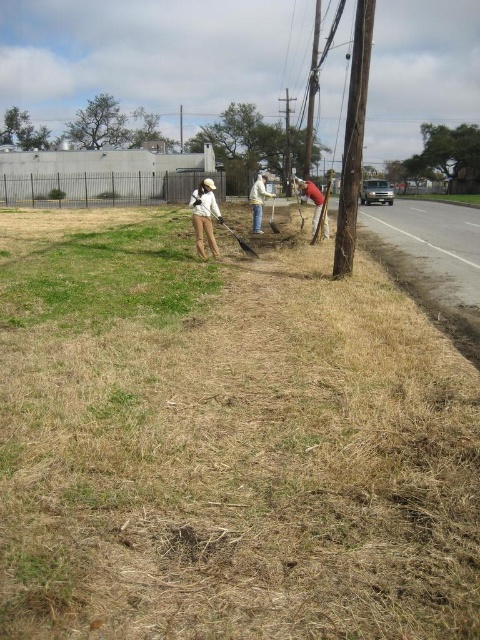
Who is shorter, light brown fabric shirt at center or white matte shirt at center?

light brown fabric shirt at center is shorter.

Is light brown fabric shirt at center further to the viewer compared to white matte shirt at center?

No, light brown fabric shirt at center is in front of white matte shirt at center.

Is point (210, 240) positioned before point (256, 182)?

Yes, it is in front of point (256, 182).

You are a GUI agent. You are given a task and a screenshot of the screen. Output one action in this format:
    pyautogui.click(x=<x>, y=<y>)
    Task: Click on the light brown fabric shirt at center
    
    Given the screenshot: What is the action you would take?
    pyautogui.click(x=204, y=216)

Can you confirm if wooden utility pole at upper right is smaller than matte red fire hydrant at center?

Correct, wooden utility pole at upper right occupies less space than matte red fire hydrant at center.

Is wooden utility pole at upper right thinner than matte red fire hydrant at center?

Correct, wooden utility pole at upper right's width is less than matte red fire hydrant at center's.

Where is `wooden utility pole at upper right`? wooden utility pole at upper right is located at coordinates (354, 138).

The width and height of the screenshot is (480, 640). Find the location of `wooden utility pole at upper right`. wooden utility pole at upper right is located at coordinates (354, 138).

Can you confirm if light brown fabric shirt at center is thinner than matte red fire hydrant at center?

No, light brown fabric shirt at center is not thinner than matte red fire hydrant at center.

Is point (217, 205) positioned after point (312, 225)?

No, (217, 205) is in front of (312, 225).

At what (x,y) coordinates should I click in order to perform the action: click on light brown fabric shirt at center. Please return your answer as a coordinate pair (x, y). This screenshot has width=480, height=640. Looking at the image, I should click on (204, 216).